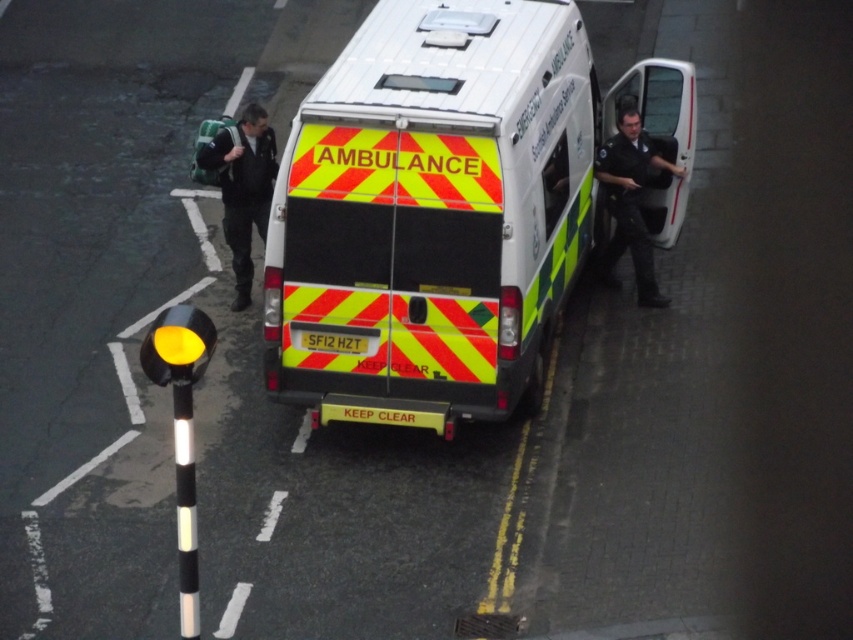
Question: Can you confirm if white glossy ambulance at center is bigger than dark blue uniform at right?

Choices:
 (A) yes
 (B) no

Answer: (A)

Question: Which object is positioned farthest from the white glossy ambulance at center?

Choices:
 (A) dark green backpack at upper left
 (B) dark blue uniform at right

Answer: (A)

Question: Can you confirm if white glossy ambulance at center is positioned below dark blue uniform at right?

Choices:
 (A) no
 (B) yes

Answer: (A)

Question: Which object is the farthest from the dark green backpack at upper left?

Choices:
 (A) white glossy ambulance at center
 (B) dark blue uniform at right

Answer: (B)

Question: Which of these objects is positioned farthest from the white glossy ambulance at center?

Choices:
 (A) dark blue uniform at right
 (B) dark green backpack at upper left

Answer: (B)

Question: Does white glossy ambulance at center have a larger size compared to dark green backpack at upper left?

Choices:
 (A) no
 (B) yes

Answer: (B)